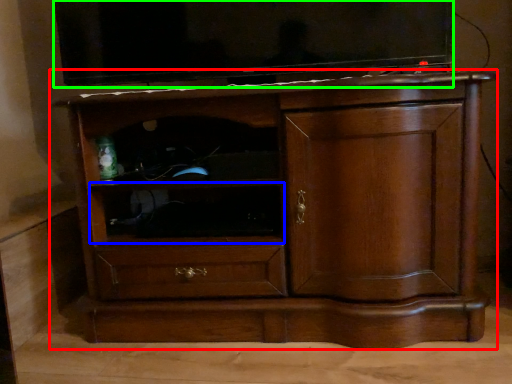
Question: Which object is positioned farthest from chest of drawers (highlighted by a red box)? Select from shelf (highlighted by a blue box) and television (highlighted by a green box).

Choices:
 (A) shelf
 (B) television

Answer: (B)